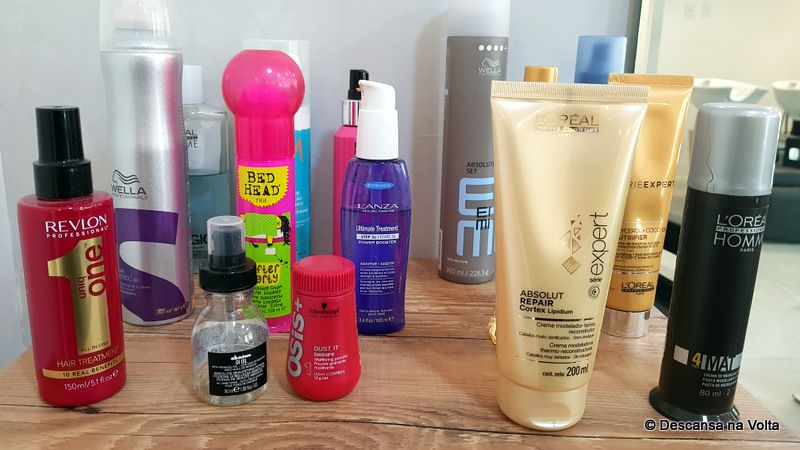
The width and height of the screenshot is (800, 450). I want to click on spray bottles, so click(148, 145), click(74, 221), click(298, 46), click(388, 111), click(342, 136), click(478, 31), click(598, 52), click(746, 129), click(538, 72).